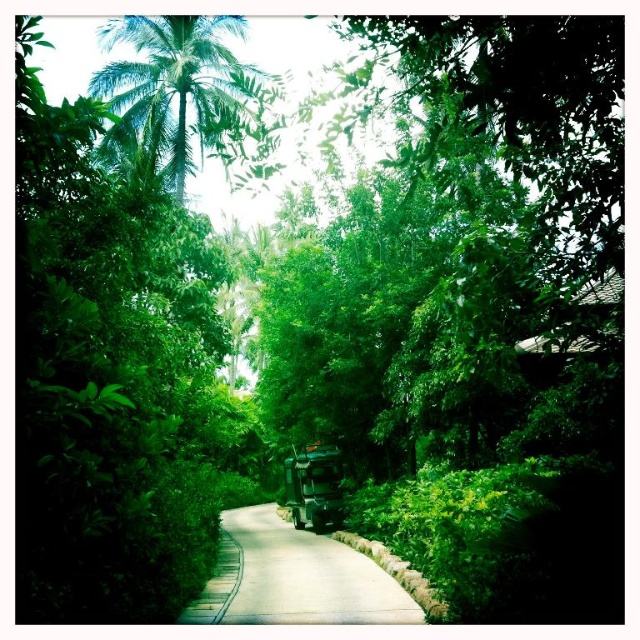
Question: Does green leafy palm tree at upper left appear on the left side of metallic green truck at center?

Choices:
 (A) no
 (B) yes

Answer: (B)

Question: Can you confirm if green leafy palm tree at upper left is positioned to the left of smooth asphalt path at center?

Choices:
 (A) no
 (B) yes

Answer: (B)

Question: Is green leafy palm tree at upper left bigger than smooth asphalt path at center?

Choices:
 (A) yes
 (B) no

Answer: (A)

Question: Which point is farther from the camera taking this photo?

Choices:
 (A) (248, 608)
 (B) (304, 499)

Answer: (B)

Question: Which point is closer to the camera taking this photo?

Choices:
 (A) (131, 17)
 (B) (385, 579)

Answer: (B)

Question: Which object is positioned closest to the green leafy palm tree at upper left?

Choices:
 (A) smooth asphalt path at center
 (B) metallic green truck at center

Answer: (B)